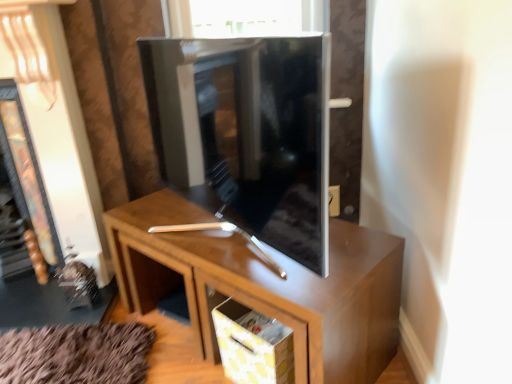
The width and height of the screenshot is (512, 384). Identify the location of matte black fireplace at left. (26, 173).

What do you see at coordinates (246, 133) in the screenshot? I see `glossy wood tv cabinet at center` at bounding box center [246, 133].

What do you see at coordinates (253, 345) in the screenshot?
I see `yellow dotted fabric drawer at lower center` at bounding box center [253, 345].

Locate an element on the screen. This screenshot has width=512, height=384. yellow dotted fabric drawer at lower center is located at coordinates (253, 345).

At what (x,y) coordinates should I click in order to perform the action: click on matte black fireplace at left. Please return your answer as a coordinate pair (x, y). Image resolution: width=512 pixels, height=384 pixels. Looking at the image, I should click on [26, 173].

Consider the image. Which object is closer to the camera, brown wood cabinet at center or yellow dotted fabric drawer at lower center?

brown wood cabinet at center.

In the image, is brown wood cabinet at center on the left side or the right side of yellow dotted fabric drawer at lower center?

brown wood cabinet at center is to the left of yellow dotted fabric drawer at lower center.

This screenshot has width=512, height=384. I want to click on cabinetry on the left side of yellow dotted fabric drawer at lower center, so click(266, 286).

Consider the image. Considering the relative sizes of brown wood cabinet at center and yellow dotted fabric drawer at lower center in the image provided, is brown wood cabinet at center smaller than yellow dotted fabric drawer at lower center?

Actually, brown wood cabinet at center might be larger than yellow dotted fabric drawer at lower center.

Is glossy wood tv cabinet at center oriented towards brown wood cabinet at center?

No.

Which point is more distant from viewer, (195, 161) or (202, 306)?

The point (202, 306) is more distant.

Does glossy wood tv cabinet at center come in front of brown wood cabinet at center?

Yes, glossy wood tv cabinet at center is in front of brown wood cabinet at center.

From a real-world perspective, who is located higher, glossy wood tv cabinet at center or matte black fireplace at left?

glossy wood tv cabinet at center is physically above.

Is glossy wood tv cabinet at center further to camera compared to matte black fireplace at left?

No, glossy wood tv cabinet at center is closer to the camera.

Is matte black fireplace at left at the back of glossy wood tv cabinet at center?

glossy wood tv cabinet at center is not turned away from matte black fireplace at left.

Would you say glossy wood tv cabinet at center contains matte black fireplace at left?

No.

From a real-world perspective, is matte black fireplace at left positioned over yellow dotted fabric drawer at lower center based on gravity?

Yes, from a real-world perspective, matte black fireplace at left is on top of yellow dotted fabric drawer at lower center.

Is matte black fireplace at left facing towards yellow dotted fabric drawer at lower center?

No, matte black fireplace at left is not aimed at yellow dotted fabric drawer at lower center.

Considering the relative sizes of matte black fireplace at left and yellow dotted fabric drawer at lower center in the image provided, is matte black fireplace at left shorter than yellow dotted fabric drawer at lower center?

Incorrect, the height of matte black fireplace at left does not fall short of that of yellow dotted fabric drawer at lower center.

Locate an element on the screen. This screenshot has width=512, height=384. tv cabinet that is in front of the brown wood cabinet at center is located at coordinates (246, 133).

Between brown wood cabinet at center and glossy wood tv cabinet at center, which one appears on the right side from the viewer's perspective?

Positioned to the right is brown wood cabinet at center.

How many degrees apart are the facing directions of brown wood cabinet at center and glossy wood tv cabinet at center?

The angular difference between brown wood cabinet at center and glossy wood tv cabinet at center is 16.5 degrees.

Is the surface of brown wood cabinet at center in direct contact with glossy wood tv cabinet at center?

No, brown wood cabinet at center is not next to glossy wood tv cabinet at center.

Could you tell me if yellow dotted fabric drawer at lower center is facing brown wood cabinet at center?

Yes.

Is yellow dotted fabric drawer at lower center placed right next to brown wood cabinet at center?

No, yellow dotted fabric drawer at lower center is not touching brown wood cabinet at center.

Considering the sizes of objects yellow dotted fabric drawer at lower center and brown wood cabinet at center in the image provided, who is taller, yellow dotted fabric drawer at lower center or brown wood cabinet at center?

Standing taller between the two is brown wood cabinet at center.

Locate an element on the screen. drawer behind the brown wood cabinet at center is located at coordinates (253, 345).

Consider the image. From a real-world perspective, between brown wood cabinet at center and matte black fireplace at left, who is vertically higher?

matte black fireplace at left, from a real-world perspective.

Which is in front, point (166, 200) or point (39, 281)?

Point (166, 200)

Considering the relative positions of brown wood cabinet at center and matte black fireplace at left in the image provided, is brown wood cabinet at center to the left of matte black fireplace at left from the viewer's perspective?

No, brown wood cabinet at center is not to the left of matte black fireplace at left.

The height and width of the screenshot is (384, 512). I want to click on drawer below the brown wood cabinet at center (from the image's perspective), so click(x=253, y=345).

The image size is (512, 384). In order to click on tv cabinet lying above the brown wood cabinet at center (from the image's perspective) in this screenshot , I will do `click(246, 133)`.

Based on their spatial positions, is brown wood cabinet at center or matte black fireplace at left closer to glossy wood tv cabinet at center?

The object closer to glossy wood tv cabinet at center is brown wood cabinet at center.

Based on their spatial positions, is matte black fireplace at left or glossy wood tv cabinet at center closer to brown wood cabinet at center?

Among the two, glossy wood tv cabinet at center is located nearer to brown wood cabinet at center.

Estimate the real-world distances between objects in this image. Which object is closer to yellow dotted fabric drawer at lower center, matte black fireplace at left or brown wood cabinet at center?

brown wood cabinet at center is closer to yellow dotted fabric drawer at lower center.

Estimate the real-world distances between objects in this image. Which object is further from glossy wood tv cabinet at center, matte black fireplace at left or yellow dotted fabric drawer at lower center?

matte black fireplace at left.

Which object lies further to the anchor point matte black fireplace at left, yellow dotted fabric drawer at lower center or glossy wood tv cabinet at center?

Based on the image, yellow dotted fabric drawer at lower center appears to be further to matte black fireplace at left.

When comparing their distances from matte black fireplace at left, does yellow dotted fabric drawer at lower center or brown wood cabinet at center seem further?

The object further to matte black fireplace at left is yellow dotted fabric drawer at lower center.

Consider the image. Considering their positions, is brown wood cabinet at center positioned further to yellow dotted fabric drawer at lower center than glossy wood tv cabinet at center?

glossy wood tv cabinet at center lies further to yellow dotted fabric drawer at lower center than the other object.

From the image, which object appears to be nearer to matte black fireplace at left, brown wood cabinet at center or yellow dotted fabric drawer at lower center?

brown wood cabinet at center.

I want to click on cabinetry that lies between glossy wood tv cabinet at center and yellow dotted fabric drawer at lower center from top to bottom, so click(266, 286).

I want to click on tv cabinet between matte black fireplace at left and brown wood cabinet at center in the horizontal direction, so [x=246, y=133].

This screenshot has height=384, width=512. I want to click on tv cabinet between matte black fireplace at left and yellow dotted fabric drawer at lower center, so click(246, 133).

Where is `cabinetry between matte black fireplace at left and yellow dotted fabric drawer at lower center from left to right`? cabinetry between matte black fireplace at left and yellow dotted fabric drawer at lower center from left to right is located at coordinates (266, 286).